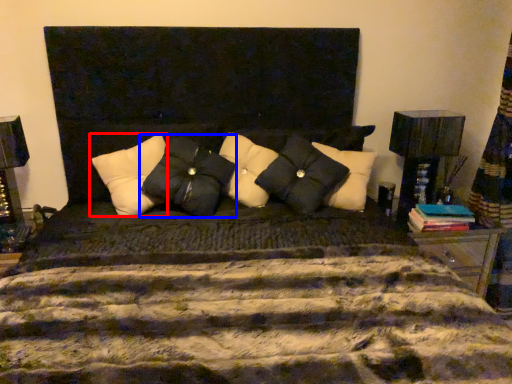
Question: Which of the following is the farthest to the observer, pillow (highlighted by a red box) or pillow (highlighted by a blue box)?

Choices:
 (A) pillow
 (B) pillow

Answer: (A)